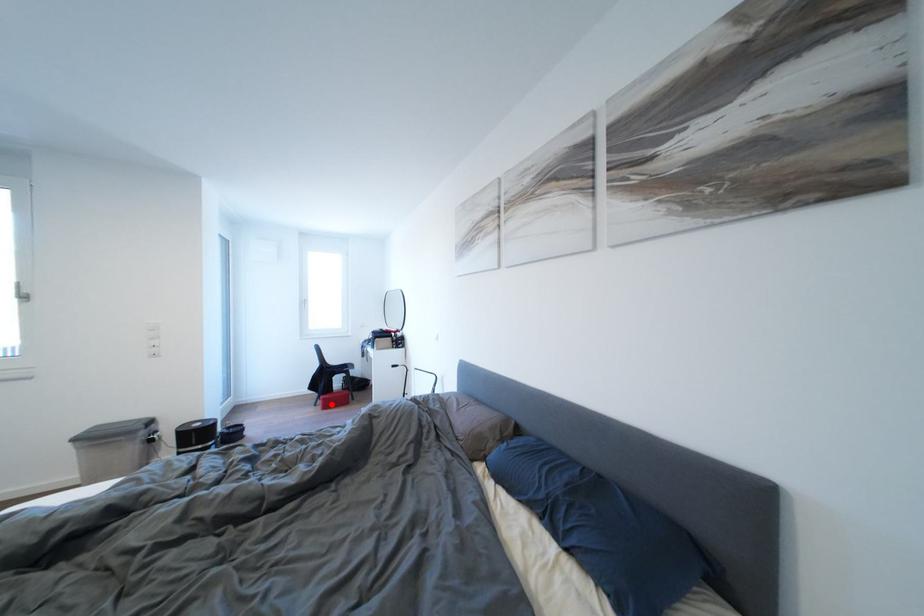
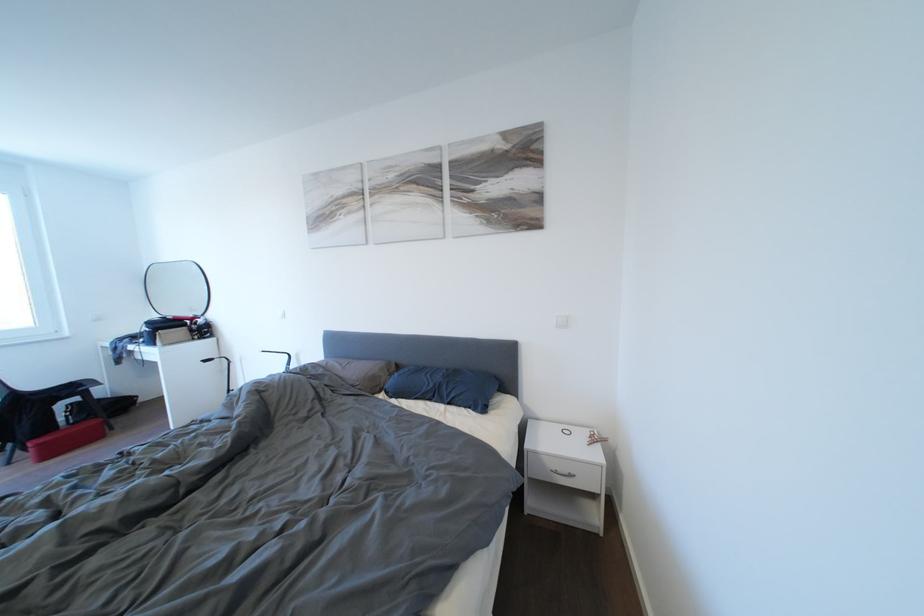
The point at the highlighted location is marked in the first image. Where is the corresponding point in the second image?

(46, 450)